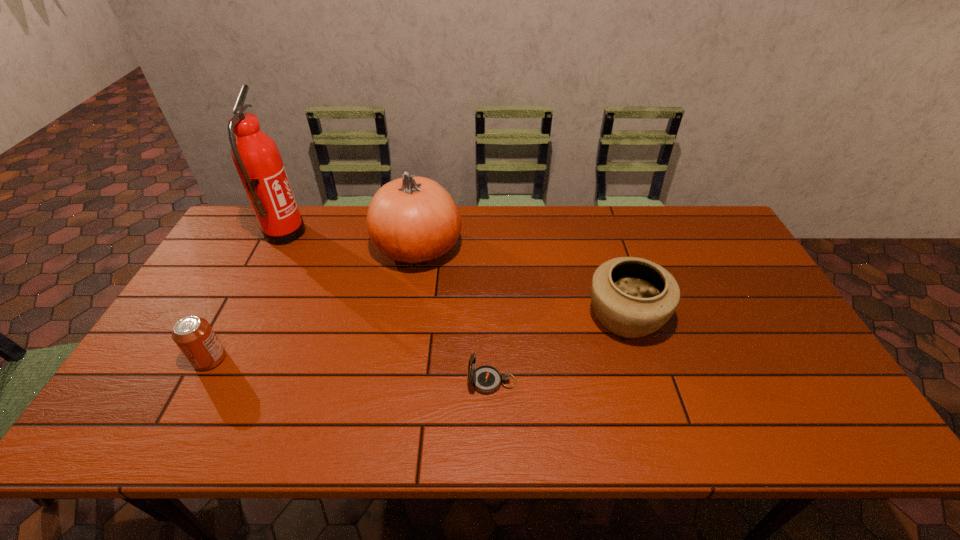
Identify the location of vacant region that satisfies the following two spatial constraints: 1. on the front side of the third object from right to left; 2. on the left side of the rightmost object. (407, 318).

This screenshot has width=960, height=540. I want to click on vacant space that satisfies the following two spatial constraints: 1. on the front side of the third shortest object; 2. on the face of the compass, so click(x=645, y=382).

You are a GUI agent. You are given a task and a screenshot of the screen. Output one action in this format:
    pyautogui.click(x=<x>, y=<y>)
    Task: Click on the vacant space that satisfies the following two spatial constraints: 1. on the label side of the third object from right to left; 2. on the right side of the fire extinguisher
    The height and width of the screenshot is (540, 960).
    Given the screenshot: What is the action you would take?
    pyautogui.click(x=276, y=248)